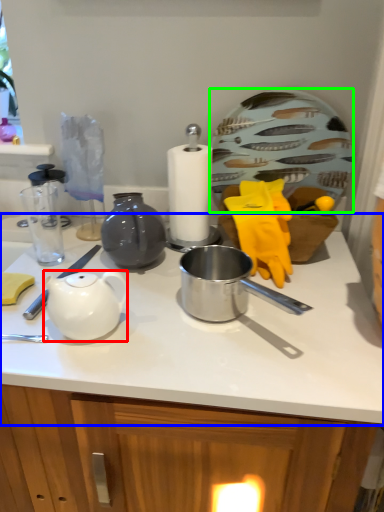
Question: Considering the real-world distances, which object is closest to teapot (highlighted by a red box)? countertop (highlighted by a blue box) or plate (highlighted by a green box).

Choices:
 (A) countertop
 (B) plate

Answer: (A)